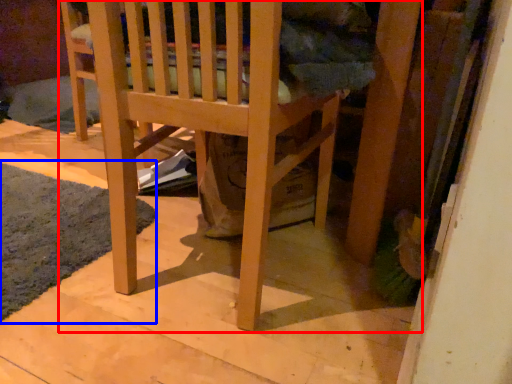
Question: Which object appears farthest to the camera in this image, furniture (highlighted by a red box) or mat (highlighted by a blue box)?

Choices:
 (A) furniture
 (B) mat

Answer: (B)